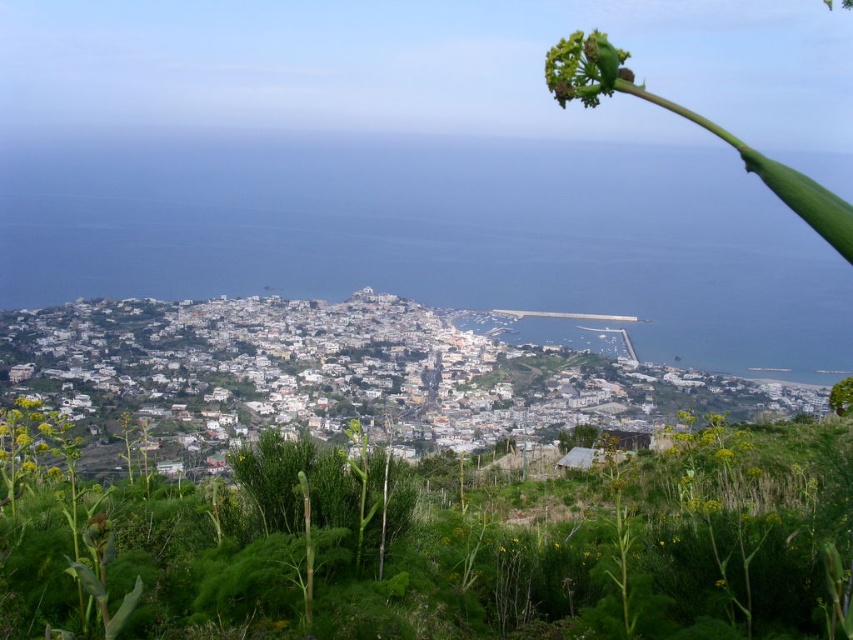
You are standing at the green leafy plant at lower left and want to walk to the green fuzzy flower at upper center. Given that the distance between them is 481.64 meters, would you need to walk more than half a kilometer to reach it?

The distance between the green fuzzy flower at upper center and the green leafy plant at lower left is 481.64 meters. Since half a kilometer is 500 meters, you would need to walk slightly less than half a kilometer to reach the green fuzzy flower at upper center from the green leafy plant at lower left.

You are a gardener who wants to plant a new flower bed in the coastal town. You have two plants available, the green leafy plant at center and the green fuzzy flower at upper center. Considering their heights, which one should you choose if you want a taller plant in the front of the flower bed to create a layered look?

The green leafy plant at center is much taller than the green fuzzy flower at upper center, so you should choose the green leafy plant at center for the front of the flower bed to create a layered look.